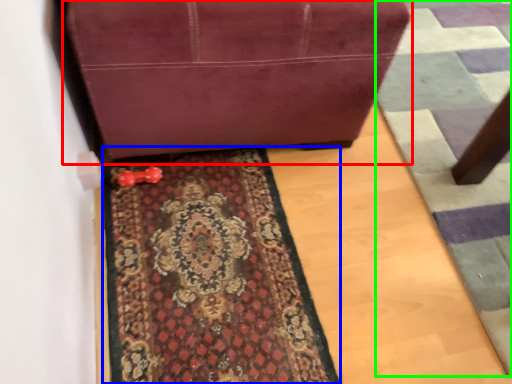
Question: Considering the real-world distances, which object is farthest from furniture (highlighted by a red box)? mat (highlighted by a blue box) or doormat (highlighted by a green box)?

Choices:
 (A) mat
 (B) doormat

Answer: (B)